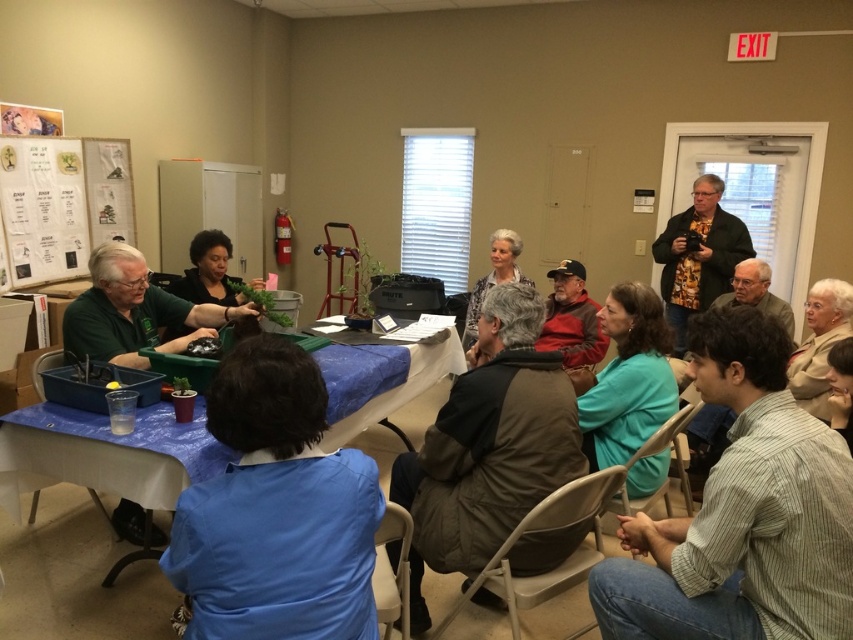
Looking at this image, you are standing at the camera position and want to reach the point marked as point (512, 432). Is the distance less than 7 feet?

The distance between the camera and point (512, 432) is 6.46 feet, which is less than 7 feet.